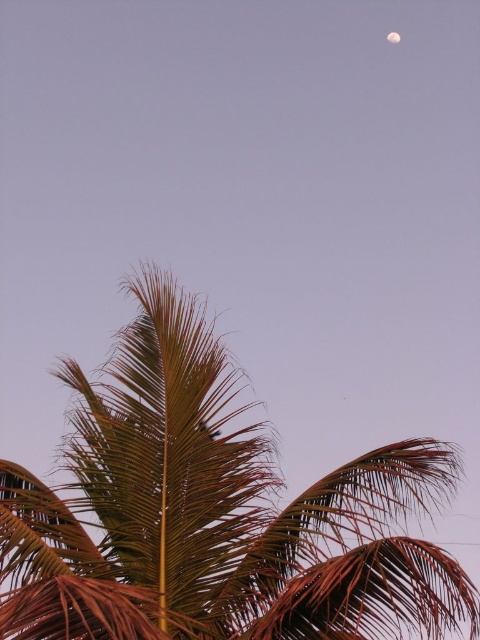
Is brown leafy coconut tree at upper center positioned behind smooth gray moon at upper right?

No, it is not.

Between point (446, 557) and point (396, 42), which one is positioned in front?

Positioned in front is point (446, 557).

Identify the location of brown leafy coconut tree at upper center. (215, 513).